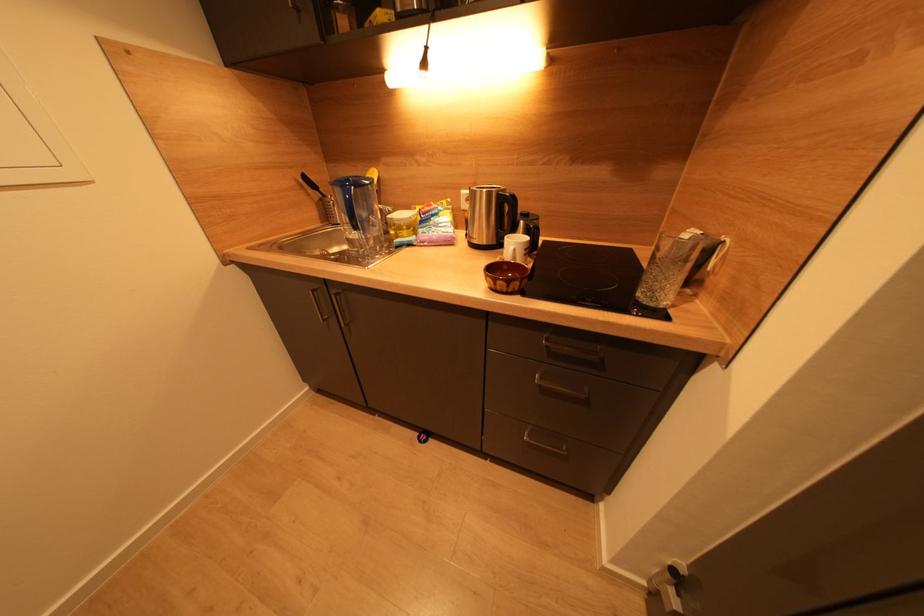
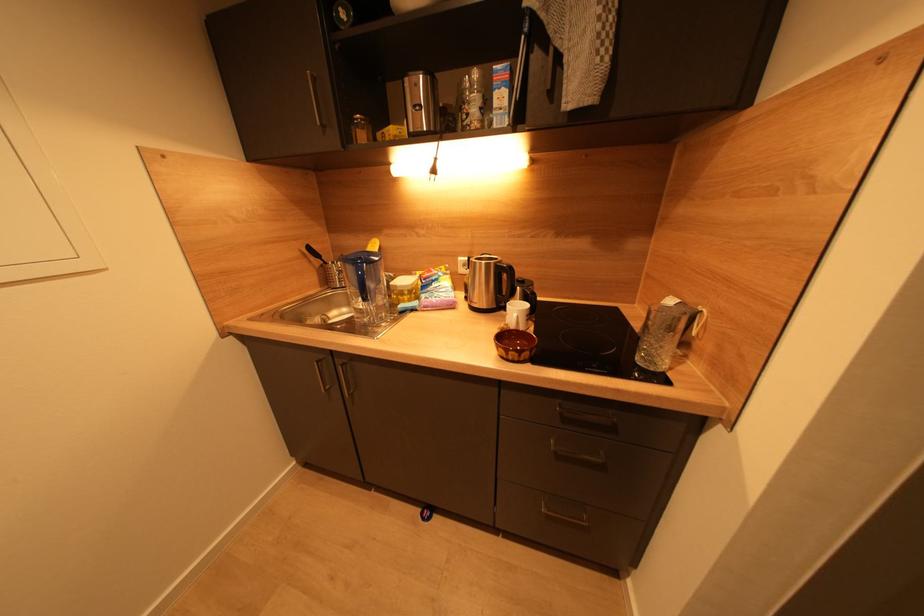
Question: Based on the continuous images, in which direction is the camera rotating? Reply with the corresponding letter.

Choices:
 (A) Left
 (B) Right
 (C) Up
 (D) Down

Answer: (C)